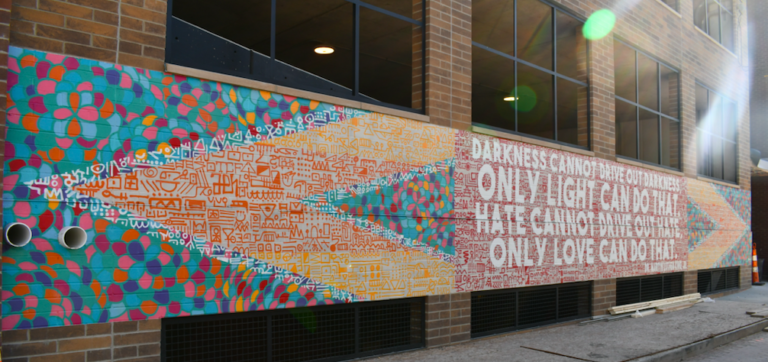
Image resolution: width=768 pixels, height=362 pixels. Find the location of `left light`. left light is located at coordinates (316, 45).